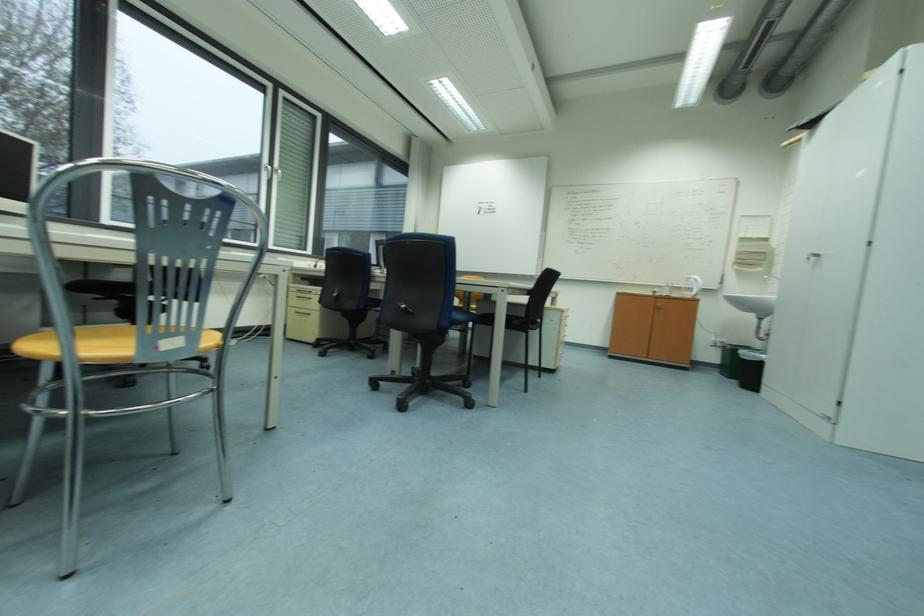
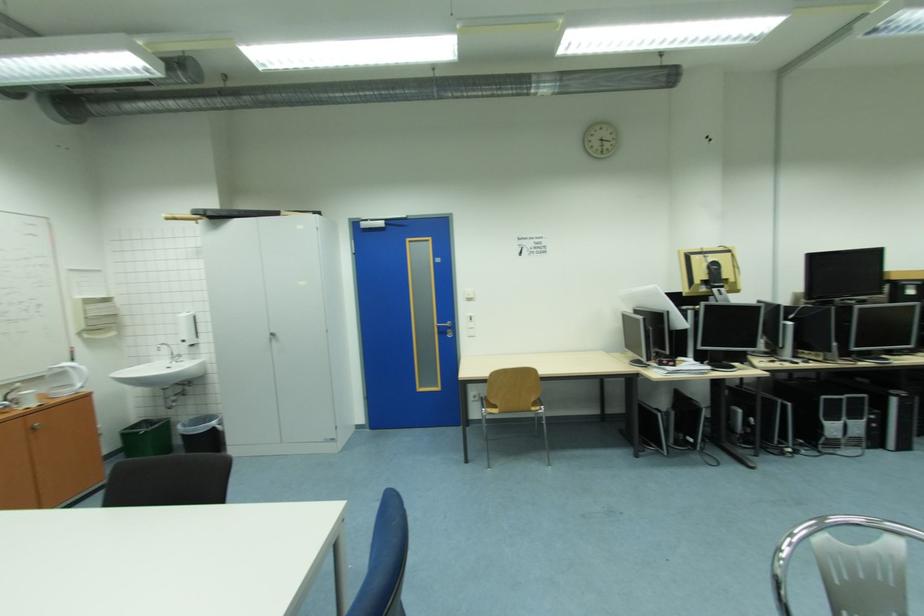
Where in the second image is the point corresponding to point 821,259 from the first image?

(278, 338)